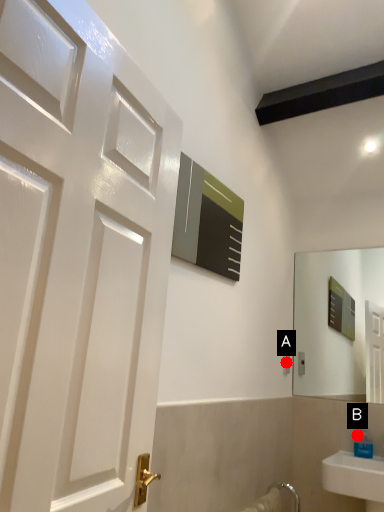
Question: Two points are circled on the image, labeled by A and B beside each circle. Which point appears closest to the camera in this image?

Choices:
 (A) A is closer
 (B) B is closer

Answer: (B)